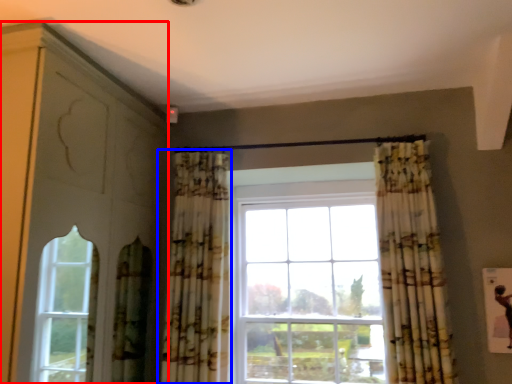
Question: Which object is closer to the camera taking this photo, dresser (highlighted by a red box) or curtain (highlighted by a blue box)?

Choices:
 (A) dresser
 (B) curtain

Answer: (A)